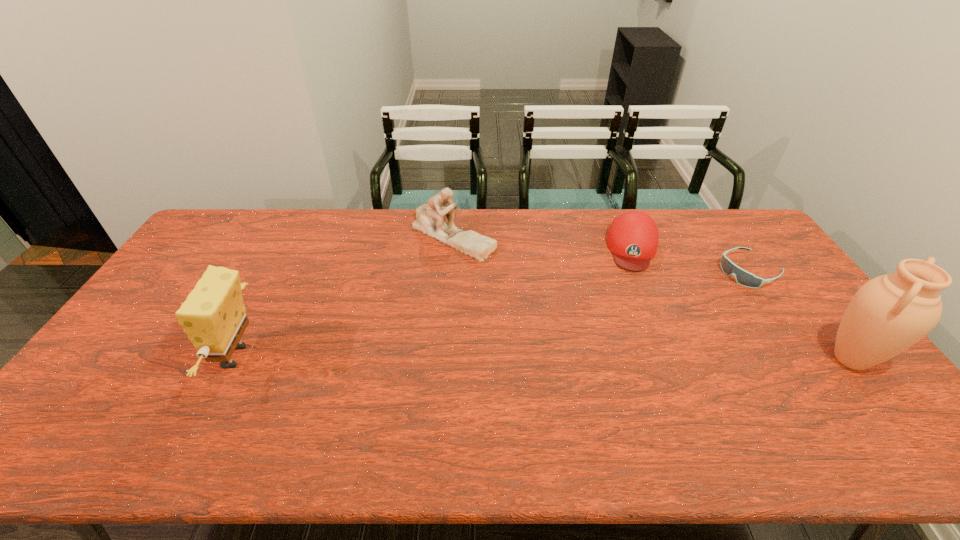
Identify the location of vacant space on the desktop that is between the sponge and the tallest object and is positioned on the front-facing side of the third tallest object. The width and height of the screenshot is (960, 540). (471, 357).

The height and width of the screenshot is (540, 960). Identify the location of free space on the desktop that is between the leftmost object and the tallest object and is positioned on the front-facing side of the third object from left to right. (633, 358).

At what (x,y) coordinates should I click in order to perform the action: click on free spot on the desktop that is between the leftmost object and the tallest object and is positioned on the front-facing side of the goggles. Please return your answer as a coordinate pair (x, y). The height and width of the screenshot is (540, 960). Looking at the image, I should click on (583, 358).